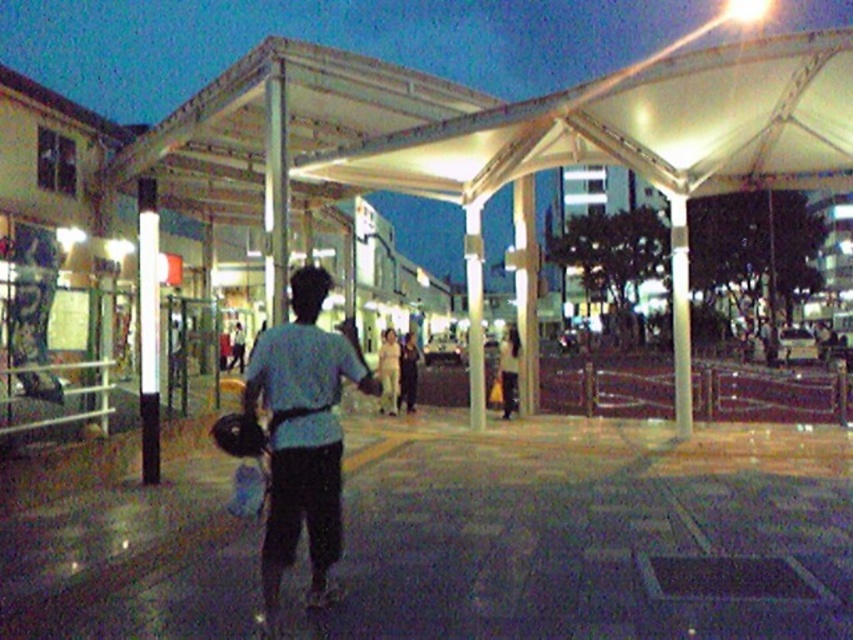
Question: Is white translucent canopy at upper center behind light beige fabric bag at center?

Choices:
 (A) yes
 (B) no

Answer: (B)

Question: Which of the following is the farthest from the observer?

Choices:
 (A) light beige fabric bag at center
 (B) light blue fabric shirt at center
 (C) light beige fabric pants at center
 (D) light blue shirt at center

Answer: (D)

Question: Is white translucent canopy at upper center below light blue shirt at center?

Choices:
 (A) yes
 (B) no

Answer: (B)

Question: Estimate the real-world distances between objects in this image. Which object is farther from the light beige fabric pants at center?

Choices:
 (A) light beige fabric bag at center
 (B) white translucent canopy at upper center

Answer: (B)

Question: Can you confirm if light blue fabric shirt at center is positioned below light beige fabric pants at center?

Choices:
 (A) no
 (B) yes

Answer: (A)

Question: Which object is positioned farthest from the white translucent canopy at upper center?

Choices:
 (A) light beige fabric bag at center
 (B) light blue shirt at center
 (C) light blue fabric shirt at center
 (D) light beige fabric pants at center

Answer: (B)